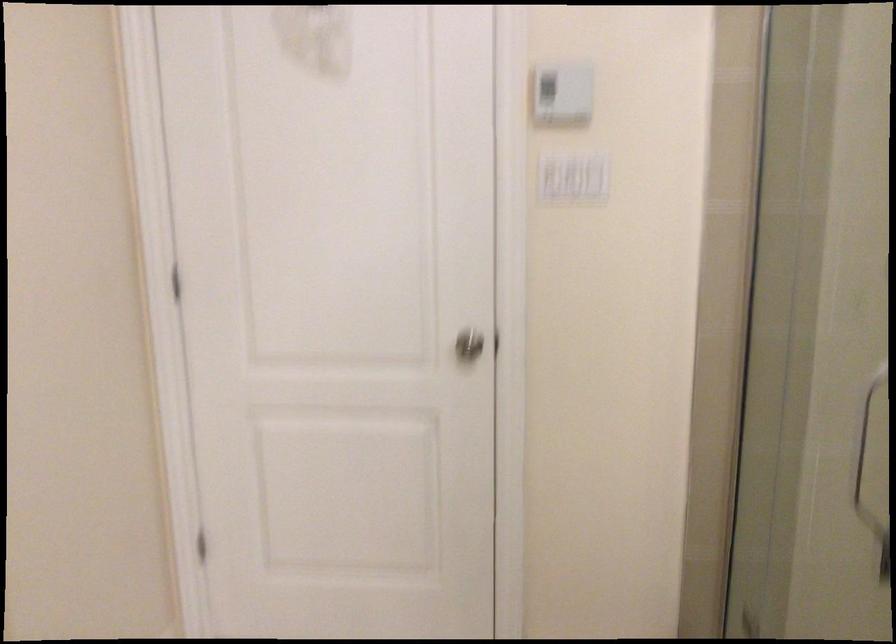
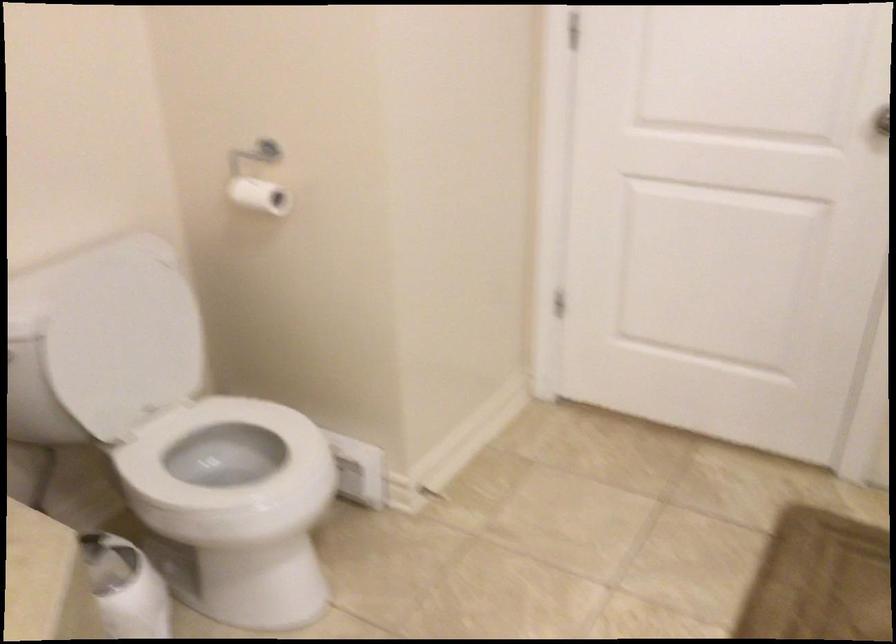
In the second image, find the point that corresponds to (467,315) in the first image.

(879, 131)